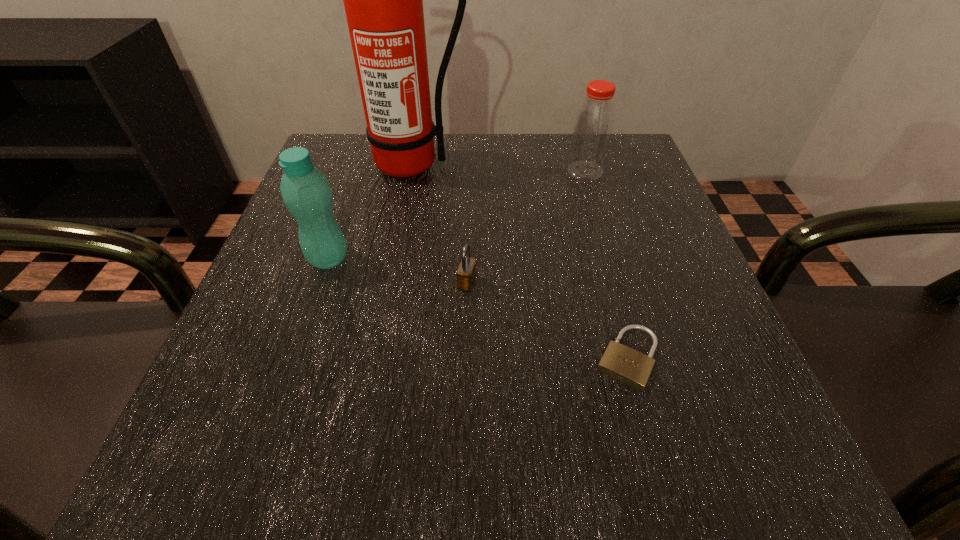
Locate an element on the screen. This screenshot has height=540, width=960. vacant area that lies between the farther bottle and the nearest object is located at coordinates (606, 265).

Where is `unoccupied position between the right bottle and the nearer padlock`? unoccupied position between the right bottle and the nearer padlock is located at coordinates (606, 265).

You are a GUI agent. You are given a task and a screenshot of the screen. Output one action in this format:
    pyautogui.click(x=<x>, y=<y>)
    Task: Click on the vacant space in between the taller padlock and the left bottle
    The height and width of the screenshot is (540, 960).
    Given the screenshot: What is the action you would take?
    pyautogui.click(x=397, y=271)

This screenshot has height=540, width=960. Identify the location of free point between the fire extinguisher and the left bottle. (371, 211).

Find the location of a particular element. vacant region between the tallest object and the nearer bottle is located at coordinates (371, 211).

You are a GUI agent. You are given a task and a screenshot of the screen. Output one action in this format:
    pyautogui.click(x=<x>, y=<y>)
    Task: Click on the vacant area that lies between the fire extinguisher and the farther bottle
    Image resolution: width=960 pixels, height=540 pixels.
    Given the screenshot: What is the action you would take?
    [x=499, y=168]

Image resolution: width=960 pixels, height=540 pixels. I want to click on free space between the shortest object and the farther padlock, so click(x=547, y=320).

You are a GUI agent. You are given a task and a screenshot of the screen. Output one action in this format:
    pyautogui.click(x=<x>, y=<y>)
    Task: Click on the object that is the fourth closest to the right bottle
    
    Given the screenshot: What is the action you would take?
    pyautogui.click(x=305, y=190)

Select which object appears as the closest to the fire extinguisher. Please provide its 2D coordinates. Your answer should be formatted as a tuple, i.e. [(x, y)], where the tuple contains the x and y coordinates of a point satisfying the conditions above.

[(305, 190)]

This screenshot has height=540, width=960. What are the coordinates of `blank area in the image that satisfies the following two spatial constraints: 1. on the handle side of the farther bottle; 2. on the left side of the tallest object` in the screenshot? It's located at (411, 171).